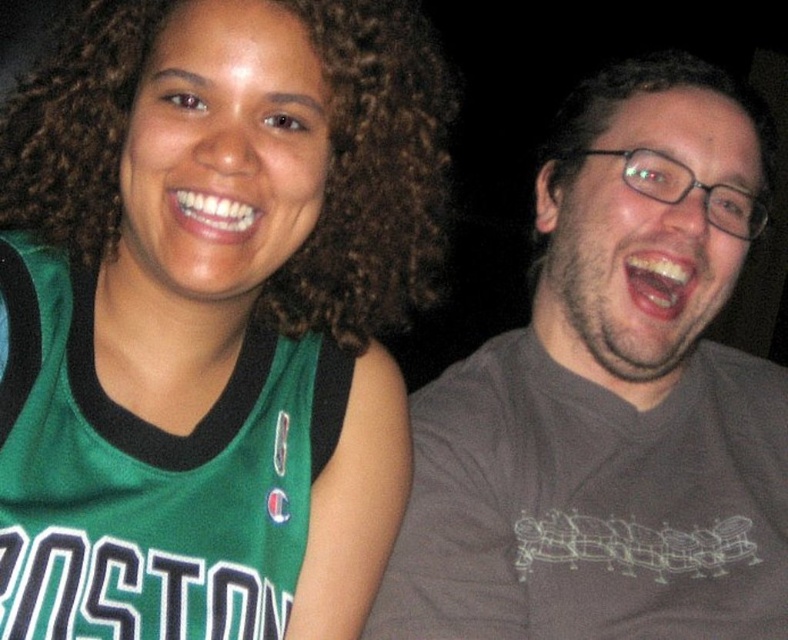
Based on the photo, based on the scene description, where is the green jersey at center located in terms of coordinates?

The green jersey at center is located at coordinates point (210, 314).

You are standing in front of a photo of two people. The photo has a dark background. You notice a point at coordinates [210,314]. Which object from the scene is located exactly at that point?

The green jersey at center is located exactly at point [210,314].